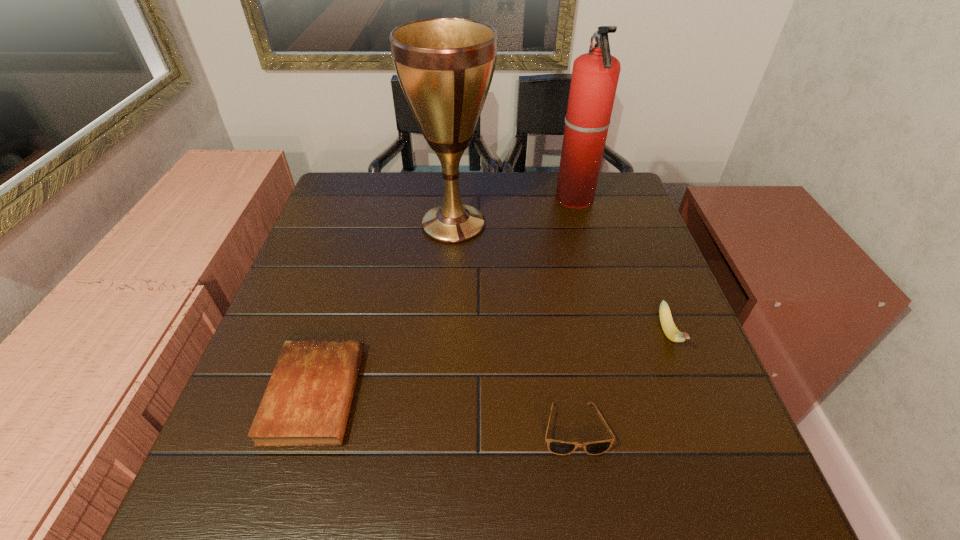
Image resolution: width=960 pixels, height=540 pixels. What are the coordinates of `the fourth object from right to left` in the screenshot? It's located at click(445, 66).

At what (x,y) coordinates should I click in order to perform the action: click on fire extinguisher. Please return your answer as a coordinate pair (x, y). The image size is (960, 540). Looking at the image, I should click on (595, 75).

Where is `the rightmost object`? The width and height of the screenshot is (960, 540). the rightmost object is located at coordinates (667, 323).

Locate an element on the screen. This screenshot has width=960, height=540. banana is located at coordinates (667, 323).

The image size is (960, 540). I want to click on sunglasses, so click(x=557, y=447).

Locate an element on the screen. Bible is located at coordinates (307, 401).

Where is `free region located on the left of the trophy cup`? free region located on the left of the trophy cup is located at coordinates (324, 224).

At what (x,y) coordinates should I click in order to perform the action: click on free space located 0.280m with the nozzle and gauge on the fire extinguisher. Please return your answer as a coordinate pair (x, y). This screenshot has height=540, width=960. Looking at the image, I should click on (463, 199).

Where is `vacant space located 0.330m with the nozzle and gauge on the fire extinguisher`? vacant space located 0.330m with the nozzle and gauge on the fire extinguisher is located at coordinates (446, 199).

The width and height of the screenshot is (960, 540). In order to click on free spot located with the nozzle and gauge on the fire extinguisher in this screenshot , I will do `click(513, 199)`.